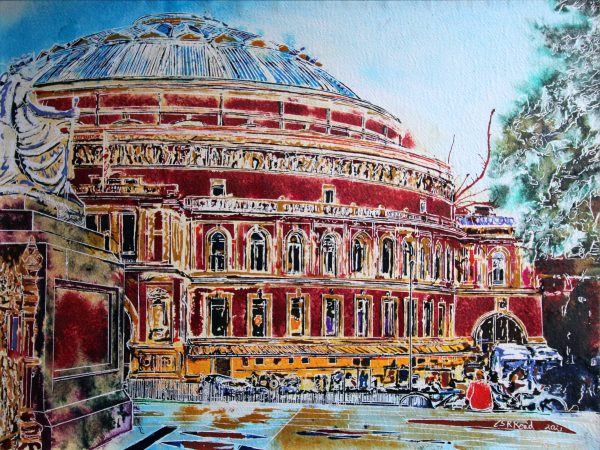
You are a GUI agent. You are given a task and a screenshot of the screen. Output one action in this format:
    pyautogui.click(x=<x>, y=<y>)
    Task: Click on the painting
    The height and width of the screenshot is (450, 600).
    Given the screenshot: What is the action you would take?
    pyautogui.click(x=325, y=195)